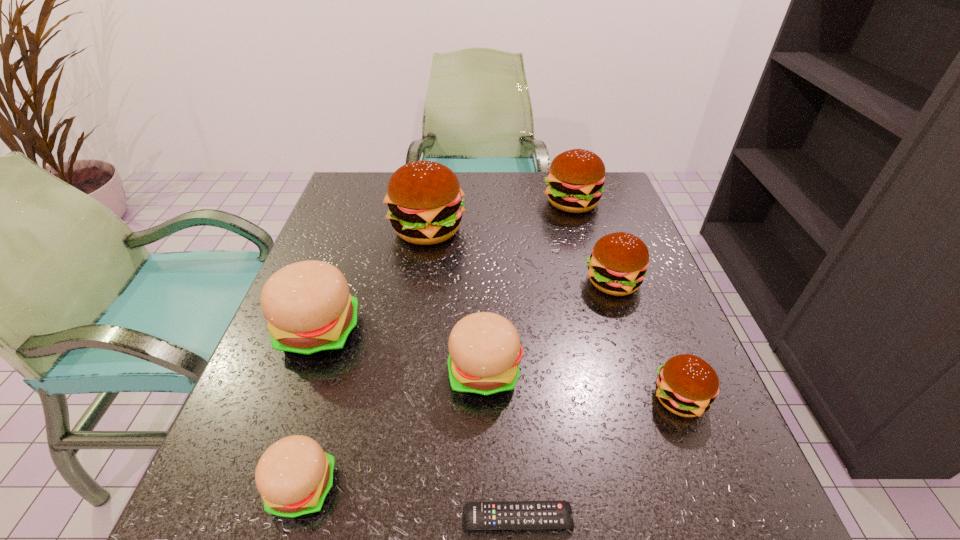
Locate an element on the screen. This screenshot has height=540, width=960. free space between the biggest beige hamburger and the biggest brown hamburger is located at coordinates (372, 281).

This screenshot has width=960, height=540. Identify the location of free point between the remote control and the third smallest brown hamburger. (544, 361).

I want to click on free spot between the rightmost beige hamburger and the smallest beige hamburger, so click(x=394, y=430).

At what (x,y) coordinates should I click in order to perform the action: click on vacant area that lies between the rightmost beige hamburger and the nearest hamburger. Please return your answer as a coordinate pair (x, y). Looking at the image, I should click on (394, 430).

Image resolution: width=960 pixels, height=540 pixels. Find the location of `empty location between the nearest brown hamburger and the second biggest beige hamburger`. empty location between the nearest brown hamburger and the second biggest beige hamburger is located at coordinates (582, 385).

Identify the location of empty location between the nearest beige hamburger and the second biggest beige hamburger. Image resolution: width=960 pixels, height=540 pixels. (394, 430).

Identify the location of object that stands as the third closest to the second biggest brown hamburger. (484, 348).

At what (x,y) coordinates should I click in order to perform the action: click on object identified as the fourth closest to the biggest beige hamburger. Please return your answer as a coordinate pair (x, y). Looking at the image, I should click on (504, 515).

Point out which hamburger is positioned as the fourth nearest to the second biggest brown hamburger. Please provide its 2D coordinates. Your answer should be formatted as a tuple, i.e. [(x, y)], where the tuple contains the x and y coordinates of a point satisfying the conditions above.

[(686, 385)]

At what (x,y) coordinates should I click in order to perform the action: click on hamburger object that ranks as the closest to the second biggest beige hamburger. Please return your answer as a coordinate pair (x, y). Looking at the image, I should click on (310, 312).